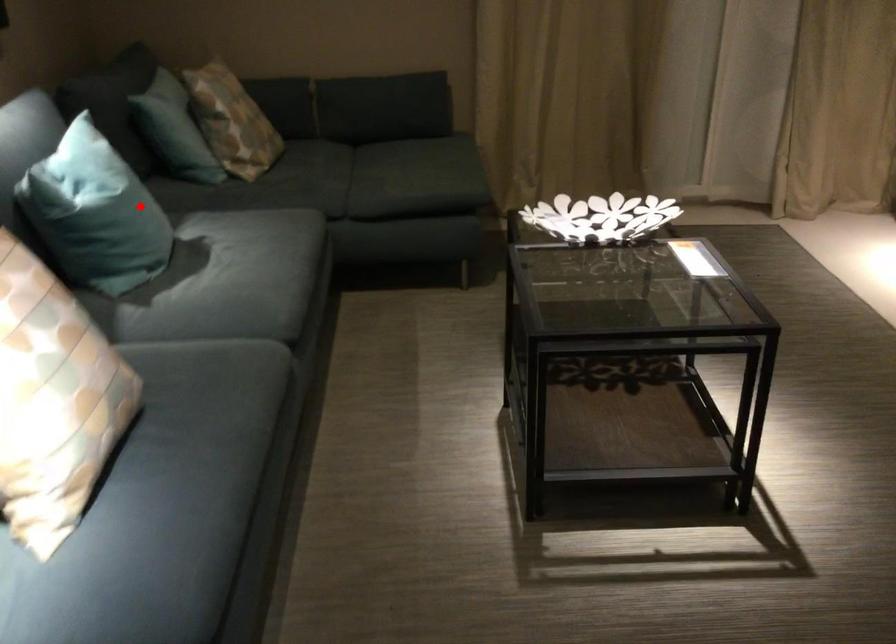
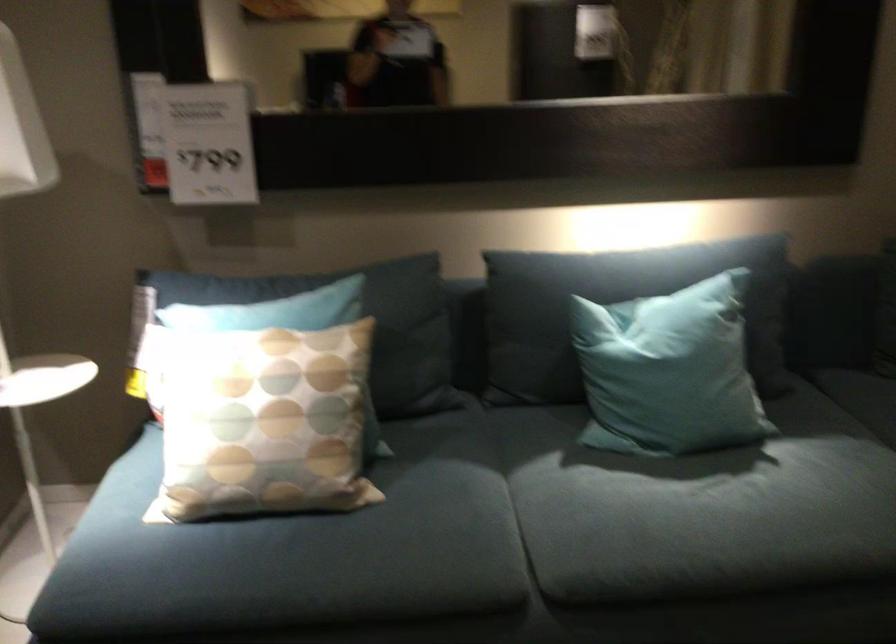
Question: A red point is marked in image1. In image2, is the corresponding 3D point closer to the camera or farther? Reply with the corresponding letter.

Choices:
 (A) The corresponding 3D point is closer.
 (B) The corresponding 3D point is farther.

Answer: (A)